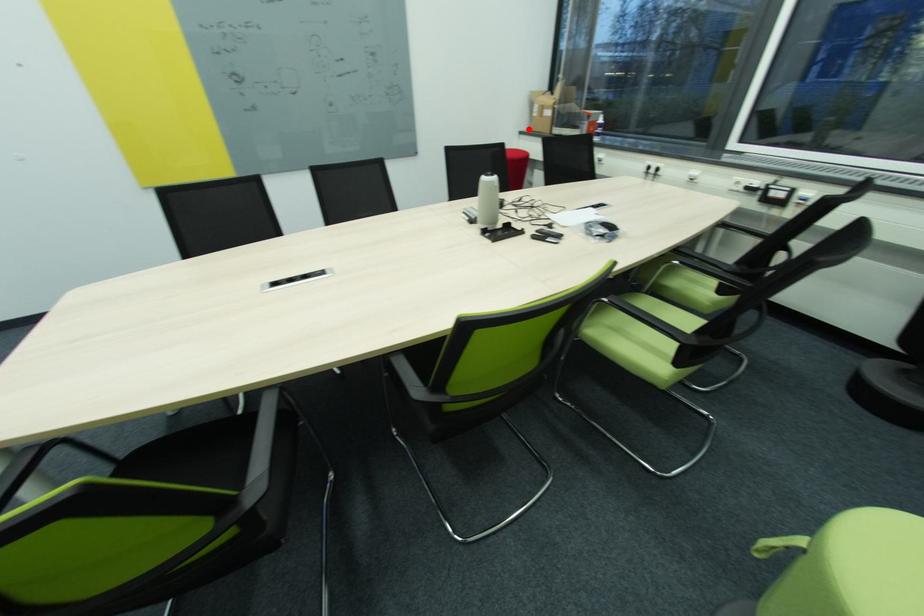
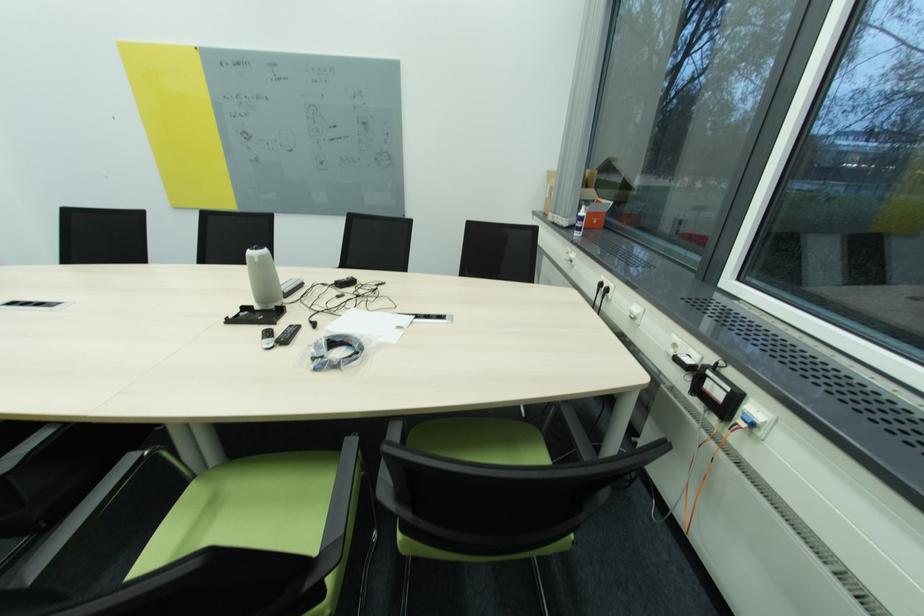
Where in the second image is the point corresponding to the highlighted location from the first image?

(544, 209)